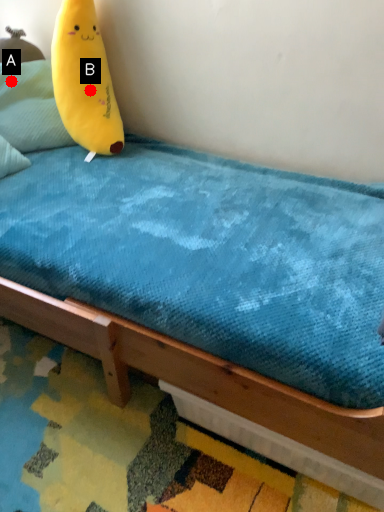
Question: Two points are circled on the image, labeled by A and B beside each circle. Among these points, which one is nearest to the camera?

Choices:
 (A) A is closer
 (B) B is closer

Answer: (B)